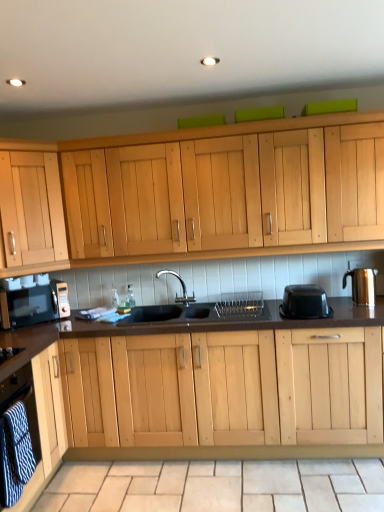
Image resolution: width=384 pixels, height=512 pixels. Describe the element at coordinates (362, 285) in the screenshot. I see `gold metallic kettle at right` at that location.

The height and width of the screenshot is (512, 384). Describe the element at coordinates (304, 302) in the screenshot. I see `black plastic container at right` at that location.

Consider the image. Measure the distance between light wood cabinet at upper left, which is counted as the second cabinetry, starting from the front, and camera.

light wood cabinet at upper left, which is counted as the second cabinetry, starting from the front, and camera are 8.72 feet apart.

Where is `beige tile at lower center`? Image resolution: width=384 pixels, height=512 pixels. beige tile at lower center is located at coordinates (217, 486).

From the image's perspective, between black matte sink at center and light wood cabinet at lower left, placed as the 2th cabinetry when sorted from top to bottom, which one is located above?

From the image's view, black matte sink at center is above.

Does black matte sink at center have a smaller size compared to light wood cabinet at lower left, acting as the 2th cabinetry starting from the back?

No, black matte sink at center is not smaller than light wood cabinet at lower left, acting as the 2th cabinetry starting from the back.

From a real-world perspective, which is physically above, black matte sink at center or light wood cabinet at lower left, placed as the 2th cabinetry when sorted from top to bottom?

In real-world perspective, black matte sink at center is above.

Which object is closer to the camera, black matte sink at center or light wood cabinet at lower left, acting as the 2th cabinetry starting from the back?

Positioned in front is light wood cabinet at lower left, acting as the 2th cabinetry starting from the back.

Is light wood cabinet at upper left, acting as the first cabinetry starting from the top, next to beige tile at lower center?

light wood cabinet at upper left, acting as the first cabinetry starting from the top, is not next to beige tile at lower center, and they're not touching.

Considering the relative sizes of light wood cabinet at upper left, acting as the 2th cabinetry starting from the bottom, and beige tile at lower center in the image provided, is light wood cabinet at upper left, acting as the 2th cabinetry starting from the bottom, bigger than beige tile at lower center?

Indeed, light wood cabinet at upper left, acting as the 2th cabinetry starting from the bottom, has a larger size compared to beige tile at lower center.

Considering the relative sizes of light wood cabinet at upper left, acting as the 2th cabinetry starting from the bottom, and beige tile at lower center in the image provided, is light wood cabinet at upper left, acting as the 2th cabinetry starting from the bottom, thinner than beige tile at lower center?

Indeed, light wood cabinet at upper left, acting as the 2th cabinetry starting from the bottom, has a lesser width compared to beige tile at lower center.

Who is bigger, black plastic container at right or matte black microwave at left?

Bigger between the two is matte black microwave at left.

Which object is further away from the camera, black plastic container at right or matte black microwave at left?

matte black microwave at left is more distant.

Which of these two, black plastic container at right or matte black microwave at left, is thinner?

Thinner between the two is matte black microwave at left.

Between black plastic container at right and matte black microwave at left, which one appears on the left side from the viewer's perspective?

From the viewer's perspective, matte black microwave at left appears more on the left side.

Between matte black microwave at left and black matte sink at center, which one has larger width?

Wider between the two is black matte sink at center.

Who is bigger, matte black microwave at left or black matte sink at center?

With larger size is black matte sink at center.

Is matte black microwave at left at the left side of black matte sink at center?

Indeed, matte black microwave at left is positioned on the left side of black matte sink at center.

Can you confirm if gold metallic kettle at right is shorter than beige tile at lower center?

No.

Between gold metallic kettle at right and beige tile at lower center, which one has smaller size?

gold metallic kettle at right.

Is gold metallic kettle at right oriented towards beige tile at lower center?

No, gold metallic kettle at right is not turned towards beige tile at lower center.

Is beige tile at lower center completely or partially inside gold metallic kettle at right?

No.

This screenshot has height=512, width=384. What are the coordinates of `sink positioned vertically above the beige tile at lower center (from a real-world perspective)` in the screenshot? It's located at (203, 311).

From a real-world perspective, between black matte sink at center and beige tile at lower center, who is vertically lower?

beige tile at lower center is physically lower.

Between black matte sink at center and gold metallic kettle at right, which one has less height?

gold metallic kettle at right.

From a real-world perspective, which is physically above, black matte sink at center or gold metallic kettle at right?

gold metallic kettle at right, from a real-world perspective.

Find the location of a particular element. The height and width of the screenshot is (512, 384). sink below the gold metallic kettle at right (from a real-world perspective) is located at coordinates (x=203, y=311).

Image resolution: width=384 pixels, height=512 pixels. Identify the location of sink lying behind the light wood cabinet at lower left, which is the first cabinetry from front to back. (203, 311).

From the beige tile at lower center, count the 2nd cabinetry to the left and point to it. Please provide its 2D coordinates.

[(31, 213)]

Looking at the image, which one is located further to black matte sink at center, light wood cabinet at upper left, acting as the first cabinetry starting from the top, or black plastic container at right?

light wood cabinet at upper left, acting as the first cabinetry starting from the top, is positioned further to the anchor black matte sink at center.

Considering their positions, is gold metallic kettle at right positioned further to black plastic container at right than black matte sink at center?

black matte sink at center.

In the scene shown: When comparing their distances from light wood cabinet at upper left, acting as the first cabinetry starting from the top, does light wood cabinet at lower left, the first cabinetry ordered from the bottom, or black plastic container at right seem closer?

Based on the image, light wood cabinet at lower left, the first cabinetry ordered from the bottom, appears to be nearer to light wood cabinet at upper left, acting as the first cabinetry starting from the top.

Looking at the image, which one is located further to light wood cabinet at lower left, acting as the 2th cabinetry starting from the back, matte black microwave at left or gold metallic kettle at right?

gold metallic kettle at right is further to light wood cabinet at lower left, acting as the 2th cabinetry starting from the back.

From the picture: When comparing their distances from gold metallic kettle at right, does black matte sink at center or light wood cabinet at lower left, acting as the 2th cabinetry starting from the back, seem closer?

Based on the image, black matte sink at center appears to be nearer to gold metallic kettle at right.

From the image, which object appears to be nearer to light wood cabinet at upper left, marked as the 1th cabinetry in a back-to-front arrangement, light wood cabinet at lower left, placed as the 2th cabinetry when sorted from top to bottom, or gold metallic kettle at right?

Among the two, light wood cabinet at lower left, placed as the 2th cabinetry when sorted from top to bottom, is located nearer to light wood cabinet at upper left, marked as the 1th cabinetry in a back-to-front arrangement.

In the scene shown: Which object lies nearer to the anchor point matte black microwave at left, gold metallic kettle at right or beige tile at lower center?

beige tile at lower center lies closer to matte black microwave at left than the other object.

From the picture: From the image, which object appears to be nearer to beige tile at lower center, light wood cabinet at upper left, acting as the 2th cabinetry starting from the bottom, or black plastic container at right?

black plastic container at right lies closer to beige tile at lower center than the other object.

Image resolution: width=384 pixels, height=512 pixels. In order to click on cabinetry between light wood cabinet at upper left, acting as the first cabinetry starting from the top, and gold metallic kettle at right, in the horizontal direction in this screenshot , I will do `click(46, 423)`.

At what (x,y) coordinates should I click in order to perform the action: click on home appliance situated between light wood cabinet at upper left, acting as the 2th cabinetry starting from the bottom, and black matte sink at center from left to right. Please return your answer as a coordinate pair (x, y). Looking at the image, I should click on (32, 300).

Where is `tile between matte black microwave at left and black plastic container at right from left to right`? The height and width of the screenshot is (512, 384). tile between matte black microwave at left and black plastic container at right from left to right is located at coordinates (217, 486).

Find the location of a particular element. tile between light wood cabinet at upper left, marked as the 1th cabinetry in a back-to-front arrangement, and black plastic container at right, in the horizontal direction is located at coordinates [217, 486].